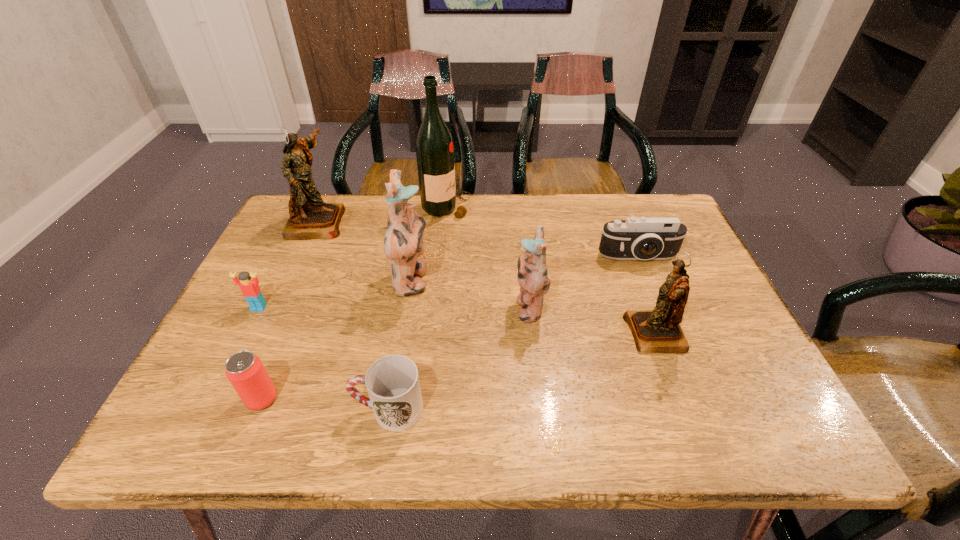
Find the location of a particular element. The width and height of the screenshot is (960, 540). figurine that is at the far edge is located at coordinates (310, 218).

Locate an element on the screen. This screenshot has height=540, width=960. beer can that is positioned at the near edge is located at coordinates (245, 371).

The height and width of the screenshot is (540, 960). What are the coordinates of `cup that is at the near edge` in the screenshot? It's located at (392, 382).

The image size is (960, 540). I want to click on figurine located in the left edge section of the desktop, so click(310, 218).

In order to click on beer can that is at the left edge in this screenshot , I will do `click(245, 371)`.

Find the location of a particular element. Lego present at the left edge is located at coordinates (250, 289).

Locate an element on the screen. The width and height of the screenshot is (960, 540). figurine at the right edge is located at coordinates (655, 331).

At what (x,y) coordinates should I click in order to perform the action: click on camera that is at the right edge. Please return your answer as a coordinate pair (x, y). This screenshot has width=960, height=540. Looking at the image, I should click on (642, 238).

Find the location of a particular element. The image size is (960, 540). object at the far left corner is located at coordinates (310, 218).

The height and width of the screenshot is (540, 960). What are the coordinates of `object at the near left corner` in the screenshot? It's located at (245, 371).